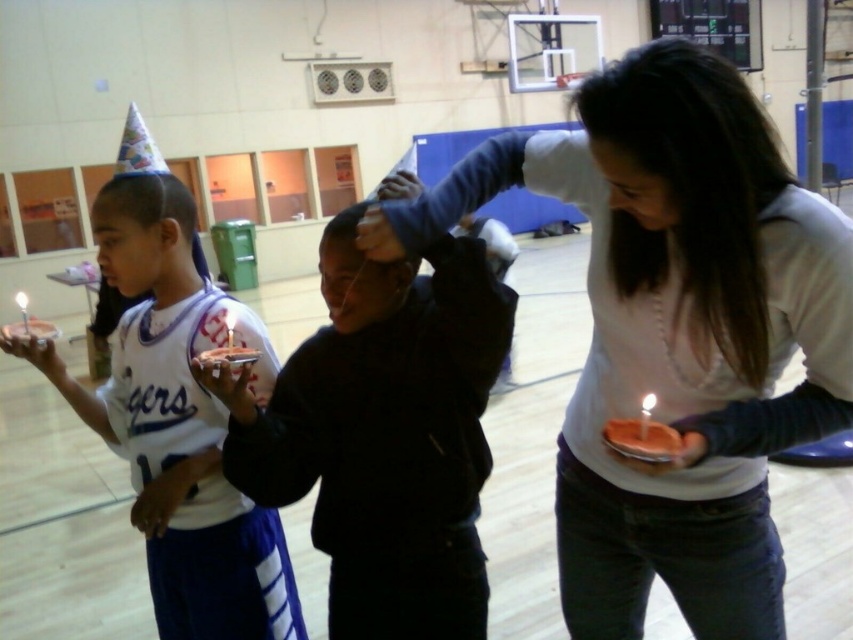
Question: Can you confirm if matte white shirt at center is positioned to the right of black matte jacket at center?

Choices:
 (A) no
 (B) yes

Answer: (B)

Question: Which of the following is the farthest from the observer?

Choices:
 (A) (461, 371)
 (B) (640, 330)
 (C) (163, 536)

Answer: (C)

Question: Which point appears closest to the camera in this image?

Choices:
 (A) (399, 618)
 (B) (648, 176)
 (C) (224, 573)

Answer: (B)

Question: Among these objects, which one is nearest to the camera?

Choices:
 (A) black matte jacket at center
 (B) white jersey at center
 (C) matte white shirt at center

Answer: (C)

Question: Is matte white shirt at center above black matte jacket at center?

Choices:
 (A) no
 (B) yes

Answer: (B)

Question: Is matte white shirt at center in front of black matte jacket at center?

Choices:
 (A) yes
 (B) no

Answer: (A)